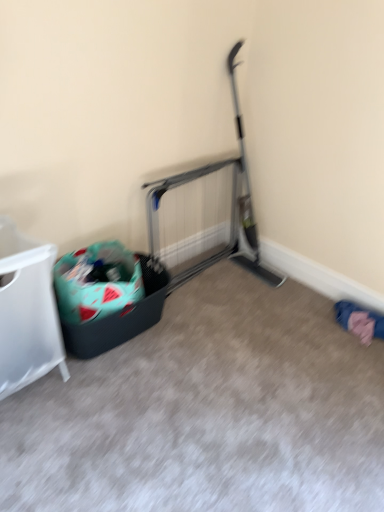
Question: Is teal fabric recycling bin at left bigger than pink fabric at lower right?

Choices:
 (A) yes
 (B) no

Answer: (A)

Question: From a real-world perspective, is teal fabric recycling bin at left below pink fabric at lower right?

Choices:
 (A) yes
 (B) no

Answer: (B)

Question: Are teal fabric recycling bin at left and pink fabric at lower right located far from each other?

Choices:
 (A) yes
 (B) no

Answer: (A)

Question: Considering the relative sizes of teal fabric recycling bin at left and pink fabric at lower right in the image provided, is teal fabric recycling bin at left smaller than pink fabric at lower right?

Choices:
 (A) yes
 (B) no

Answer: (B)

Question: Is teal fabric recycling bin at left turned away from pink fabric at lower right?

Choices:
 (A) no
 (B) yes

Answer: (A)

Question: Relative to white plastic laundry basket at left, is pink fabric at lower right in front or behind?

Choices:
 (A) behind
 (B) front

Answer: (A)

Question: From a real-world perspective, is pink fabric at lower right positioned above or below white plastic laundry basket at left?

Choices:
 (A) above
 (B) below

Answer: (B)

Question: Based on their sizes in the image, would you say pink fabric at lower right is bigger or smaller than white plastic laundry basket at left?

Choices:
 (A) big
 (B) small

Answer: (B)

Question: Is point (359, 307) closer or farther from the camera than point (6, 354)?

Choices:
 (A) closer
 (B) farther

Answer: (B)

Question: Based on their sizes in the image, would you say pink fabric at lower right is bigger or smaller than teal fabric recycling bin at left?

Choices:
 (A) small
 (B) big

Answer: (A)

Question: Is pink fabric at lower right wider or thinner than teal fabric recycling bin at left?

Choices:
 (A) thin
 (B) wide

Answer: (A)

Question: Does point (347, 316) appear closer or farther from the camera than point (129, 288)?

Choices:
 (A) farther
 (B) closer

Answer: (A)

Question: Based on their positions, is pink fabric at lower right located to the left or right of teal fabric recycling bin at left?

Choices:
 (A) left
 (B) right

Answer: (B)

Question: Is white plastic laundry basket at left bigger or smaller than teal fabric recycling bin at left?

Choices:
 (A) big
 (B) small

Answer: (A)

Question: In terms of width, does white plastic laundry basket at left look wider or thinner when compared to teal fabric recycling bin at left?

Choices:
 (A) thin
 (B) wide

Answer: (A)